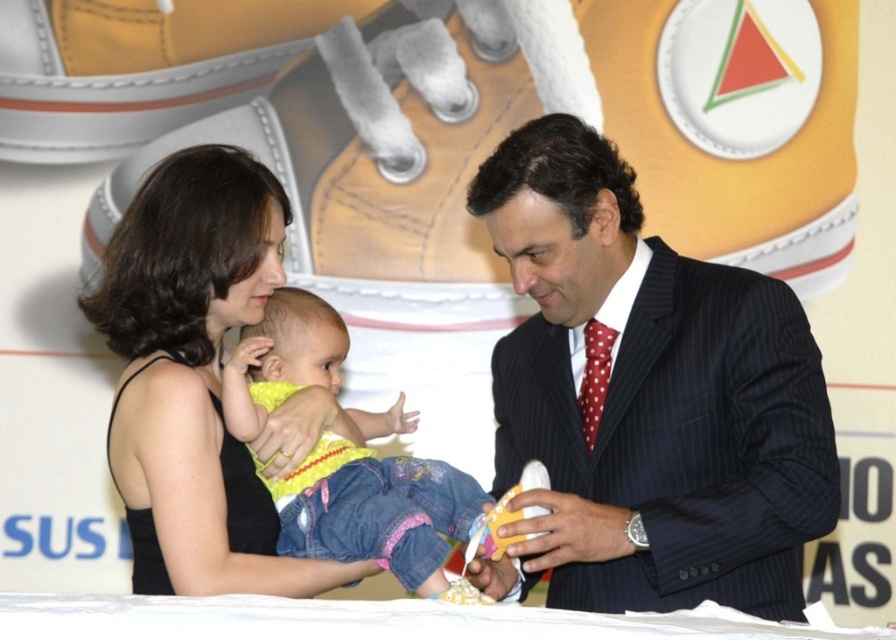
You are attending a formal event and need to determine the spatial relationship between the dark pinstripe suit at center and the yellow denim pants at center. Which one is positioned closer to you?

The dark pinstripe suit at center is closer to the viewer than the yellow denim pants at center.

You are attending a formal event and notice two outfits at the center of the scene. Which one is bigger in size between the dark pinstripe suit at center and the yellow denim pants at center?

The dark pinstripe suit at center is larger in size compared to the yellow denim pants at center.